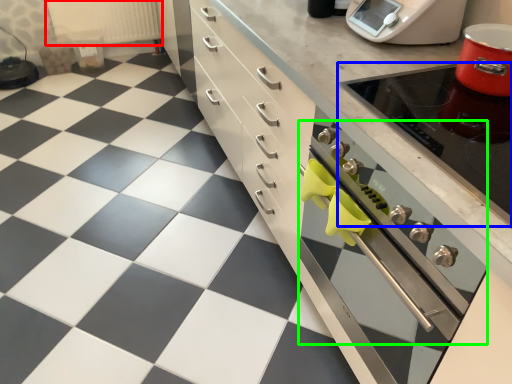
Question: Considering the real-world distances, which object is farthest from radiator (highlighted by a red box)? appliance (highlighted by a blue box) or oven (highlighted by a green box)?

Choices:
 (A) appliance
 (B) oven

Answer: (A)